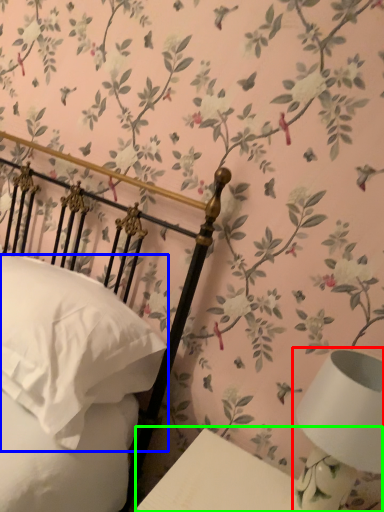
Question: Estimate the real-world distances between objects in this image. Which object is closer to table lamp (highlighted by a red box), pillow (highlighted by a blue box) or table (highlighted by a green box)?

Choices:
 (A) pillow
 (B) table

Answer: (B)